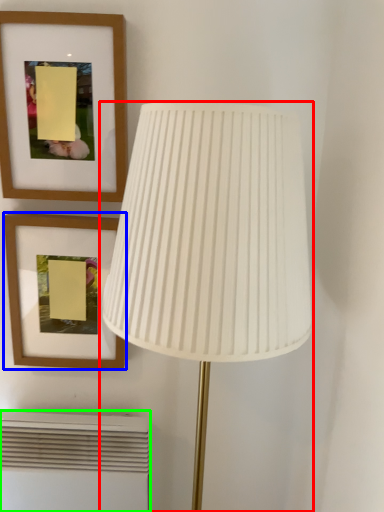
Question: Which object is positioned closest to lamp (highlighted by a red box)? Select from picture frame (highlighted by a blue box) and air conditioner (highlighted by a green box).

Choices:
 (A) picture frame
 (B) air conditioner

Answer: (A)